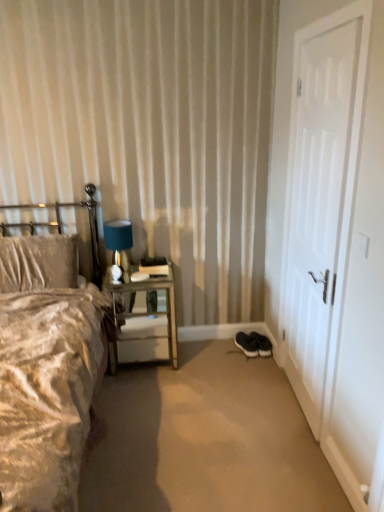
You are a GUI agent. You are given a task and a screenshot of the screen. Output one action in this format:
    pyautogui.click(x=<x>, y=<y>)
    Task: Click on the vacant area located to the right-hand side of metallic silver nightstand at left
    
    Given the screenshot: What is the action you would take?
    pyautogui.click(x=205, y=368)